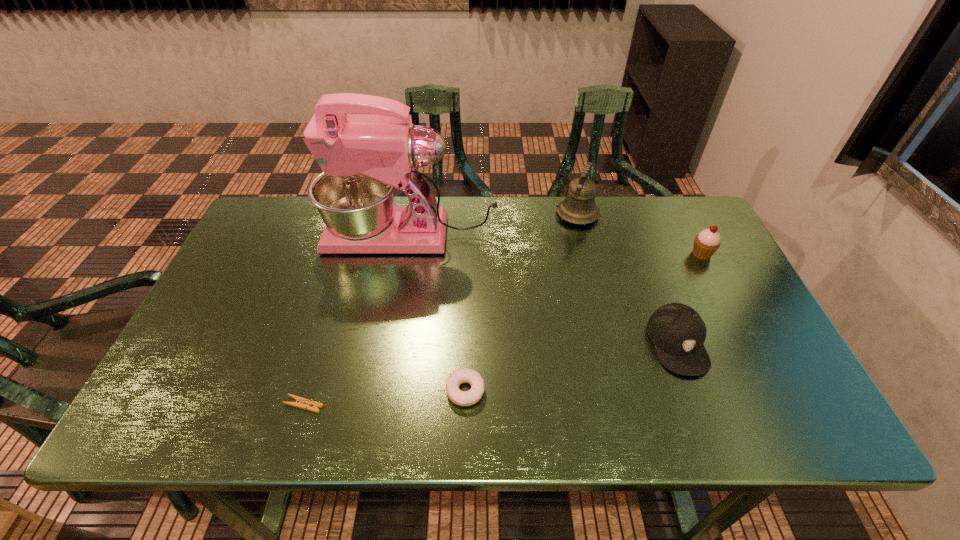
Identify the location of the tallest object. (364, 157).

At what (x,y) coordinates should I click in order to perform the action: click on the second tallest object. Please return your answer as a coordinate pair (x, y). Image resolution: width=960 pixels, height=540 pixels. Looking at the image, I should click on (579, 207).

At what (x,y) coordinates should I click in order to perform the action: click on the fourth object from left to right. Please return your answer as a coordinate pair (x, y). This screenshot has width=960, height=540. Looking at the image, I should click on (579, 207).

Identify the location of the fourth shortest object. This screenshot has height=540, width=960. (706, 243).

Identify the location of cupcake. (706, 243).

This screenshot has width=960, height=540. I want to click on the fifth object from left to right, so click(678, 332).

Where is `the fourth tallest object`? the fourth tallest object is located at coordinates (678, 332).

What are the coordinates of `the fifth tallest object` in the screenshot? It's located at (462, 398).

The height and width of the screenshot is (540, 960). I want to click on clothespin, so pos(302,403).

I want to click on vacant space located on the face of the mixer, so click(276, 235).